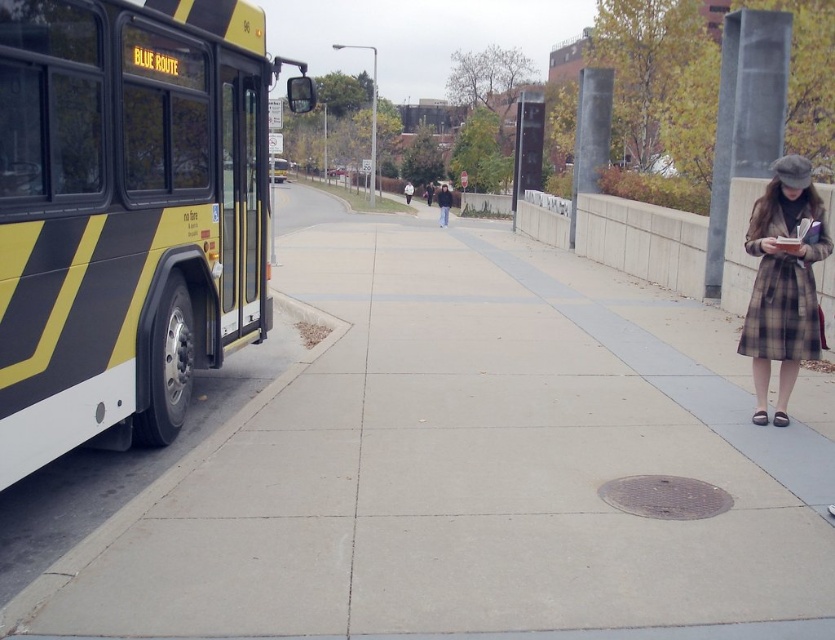
You are a pedestrian trying to cross the street safely. You see a concrete sidewalk at left and a dark gray coat at center. Which object is closer to the street?

The dark gray coat at center is closer to the street because the concrete sidewalk at left is to the right of it, meaning the coat is positioned between the sidewalk and the street.

You are standing at point (x=441, y=195) and want to walk to point (x=171, y=563). Is the point you want to reach in front of you?

Yes, the point (x=171, y=563) is in front of point (x=441, y=195), so the destination is in front of you.

You are a fashion designer observing two coats in an urban street scene. The plaid wool coat at right and the dark gray coat at center are both visible. Which coat appears narrower?

The plaid wool coat at right has a lesser width compared to the dark gray coat at center, so the plaid wool coat at right is narrower.